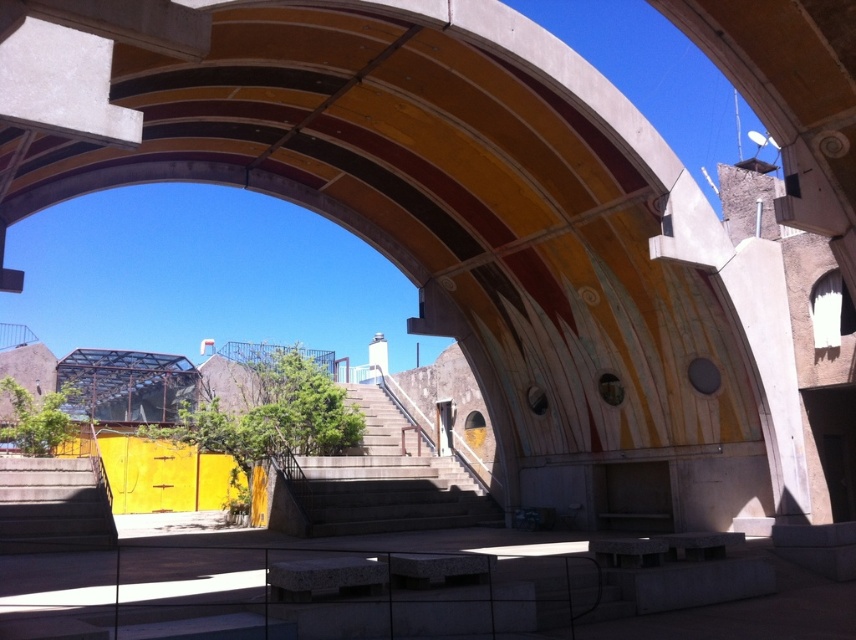
You are planning to move a large sculpture from the lower left area to the central part of the scene. The sculpture is too heavy to lift, so you need to slide it across the ground. Which path should you choose between the concrete stairs at center and the gray concrete stairs at lower left to ensure there is enough space for the sculpture to pass through?

The concrete stairs at center might be wider than gray concrete stairs at lower left, so you should choose the path through the concrete stairs at center to ensure there is enough space for the sculpture to pass through.

You are planning to move a large sculpture from the lower left to the center area. Which set of stairs, the concrete stairs at center or the gray concrete stairs at lower left, would be more suitable for transporting the sculpture?

The concrete stairs at center is larger in size than the gray concrete stairs at lower left, so the concrete stairs at center would be more suitable for transporting the large sculpture.